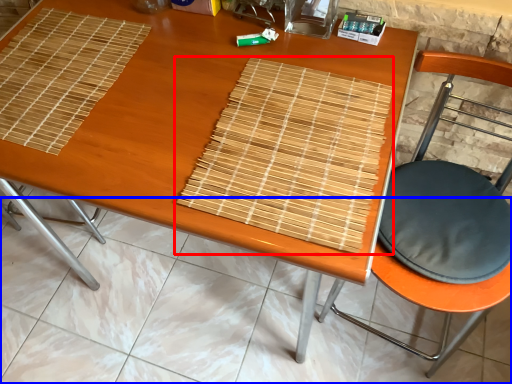
Question: Among these objects, which one is nearest to the camera, mat (highlighted by a red box) or tile (highlighted by a blue box)?

Choices:
 (A) mat
 (B) tile

Answer: (A)